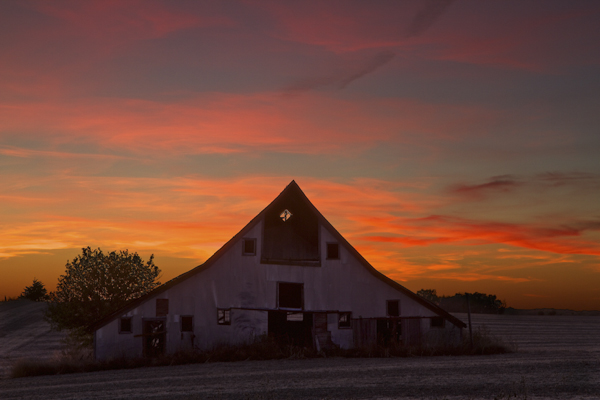
Locate an element on the screen. The image size is (600, 400). doors is located at coordinates (160, 338), (293, 330), (393, 332).